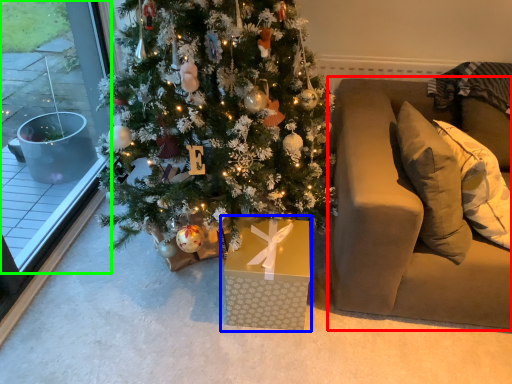
Question: Considering the real-world distances, which object is closest to studio couch (highlighted by a red box)? gift box (highlighted by a blue box) or window (highlighted by a green box).

Choices:
 (A) gift box
 (B) window

Answer: (A)